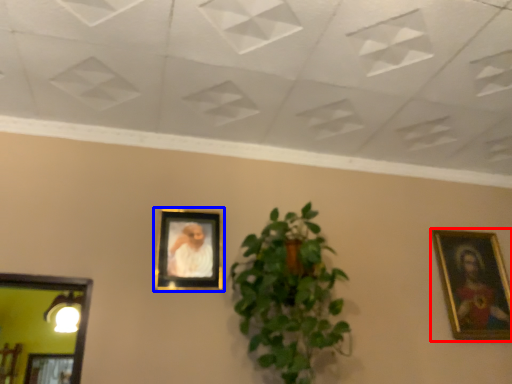
Question: Among these objects, which one is nearest to the camera, picture frame (highlighted by a red box) or picture frame (highlighted by a blue box)?

Choices:
 (A) picture frame
 (B) picture frame

Answer: (B)